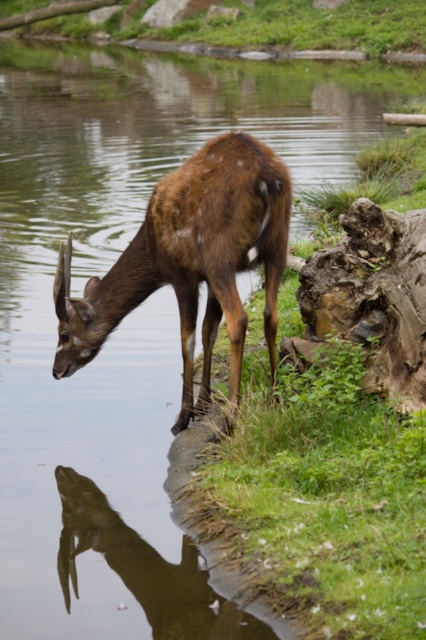
You are a photographer standing at the edge of the water. You want to take a photo of the deer and its reflection. The deer is at point (236, 205) and the reflection is at point (140, 573). Which point should you focus on first to ensure both are in focus?

You should focus on point (236, 205) first because it is closer to you than point (140, 573). Since it is closer, focusing on it will ensure the reflection at point (140, 573) is also in focus.